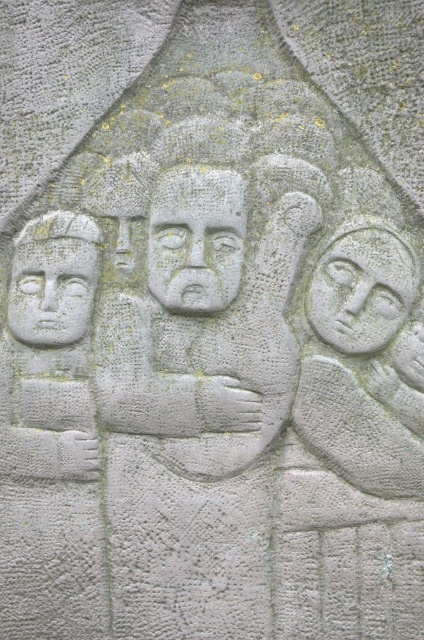
Looking at this image, in the scene of the stone carving with three figures, the carved stone face at center and the gray stone face at right are both present. Which of these two faces is bigger?

The carved stone face at center is larger in size than the gray stone face at right.

Looking at this image, you are standing in front of the stone carving and want to touch the point at coordinates (204, 298). If your hand can reach up to 1.5 meters, can you reach that point?

The point at (204, 298) is 1.64 meters from the camera, which is beyond your hand reach of 1.5 meters. You cannot reach it.

From the picture: You are an archaeologist examining the stone carving. You notice a point marked at coordinates (195, 240). What does this point indicate?

The point at (195, 240) marks the carved stone face at center.